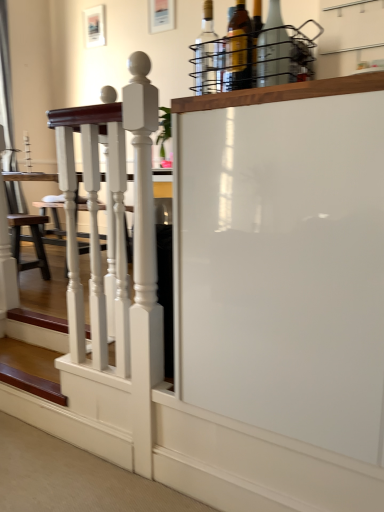
Question: Is wooden stairs at lower left at the back of matte glass bottle at upper center, the 2th bottle positioned from the right?

Choices:
 (A) yes
 (B) no

Answer: (B)

Question: From a real-world perspective, is matte glass bottle at upper center, the 2th bottle positioned from the right, beneath wooden stairs at lower left?

Choices:
 (A) no
 (B) yes

Answer: (A)

Question: Is matte glass bottle at upper center, acting as the fourth bottle starting from the left, taller than wooden stairs at lower left?

Choices:
 (A) yes
 (B) no

Answer: (A)

Question: Is matte glass bottle at upper center, acting as the fourth bottle starting from the left, to the left of wooden stairs at lower left from the viewer's perspective?

Choices:
 (A) no
 (B) yes

Answer: (A)

Question: From the image's perspective, is matte glass bottle at upper center, acting as the fourth bottle starting from the left, located beneath wooden stairs at lower left?

Choices:
 (A) no
 (B) yes

Answer: (A)

Question: Considering the positions of white glossy screen door at center and white glossy wooden railing at left in the image, is white glossy screen door at center wider or thinner than white glossy wooden railing at left?

Choices:
 (A) wide
 (B) thin

Answer: (A)

Question: Is point (322, 267) positioned closer to the camera than point (142, 207)?

Choices:
 (A) closer
 (B) farther

Answer: (A)

Question: Choose the correct answer: Is white glossy screen door at center inside white glossy wooden railing at left or outside it?

Choices:
 (A) inside
 (B) outside

Answer: (B)

Question: Based on their sizes in the image, would you say white glossy screen door at center is bigger or smaller than white glossy wooden railing at left?

Choices:
 (A) big
 (B) small

Answer: (A)

Question: Is point (261, 44) positioned closer to the camera than point (340, 324)?

Choices:
 (A) farther
 (B) closer

Answer: (A)

Question: From a real-world perspective, is clear glass bottle at upper center, the fifth bottle in the left-to-right sequence, above or below white glossy screen door at center?

Choices:
 (A) below
 (B) above

Answer: (B)

Question: In the image, is clear glass bottle at upper center, which is the first bottle in right-to-left order, positioned in front of or behind white glossy screen door at center?

Choices:
 (A) front
 (B) behind

Answer: (B)

Question: Looking at their shapes, would you say clear glass bottle at upper center, the fifth bottle in the left-to-right sequence, is wider or thinner than white glossy screen door at center?

Choices:
 (A) thin
 (B) wide

Answer: (A)

Question: Relative to translucent glass bottle at upper center, which appears as the 4th bottle when viewed from the right, is clear glass bottle at upper center, which is the first bottle in right-to-left order, in front or behind?

Choices:
 (A) behind
 (B) front

Answer: (B)

Question: Is clear glass bottle at upper center, the fifth bottle in the left-to-right sequence, to the left or to the right of translucent glass bottle at upper center, the second bottle when ordered from left to right, in the image?

Choices:
 (A) left
 (B) right

Answer: (B)